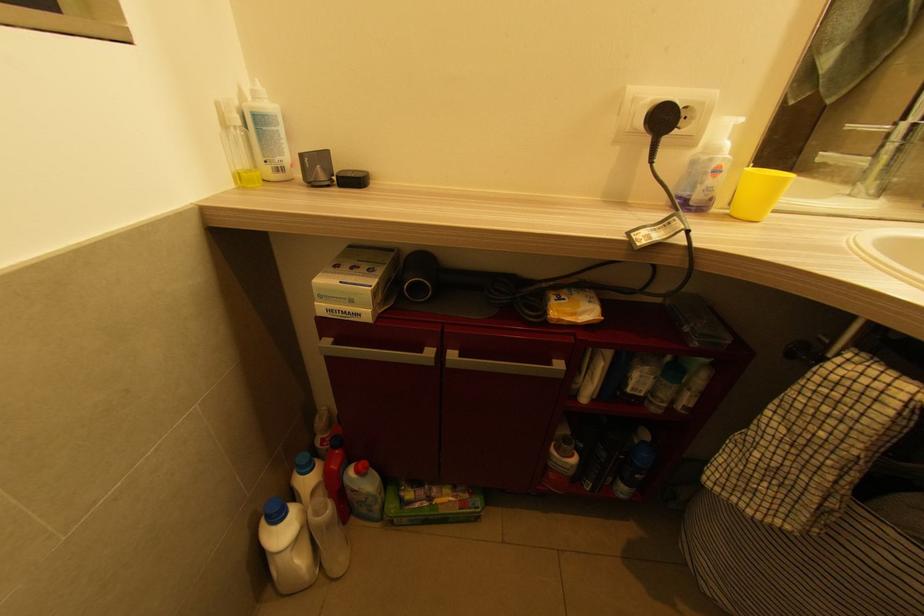
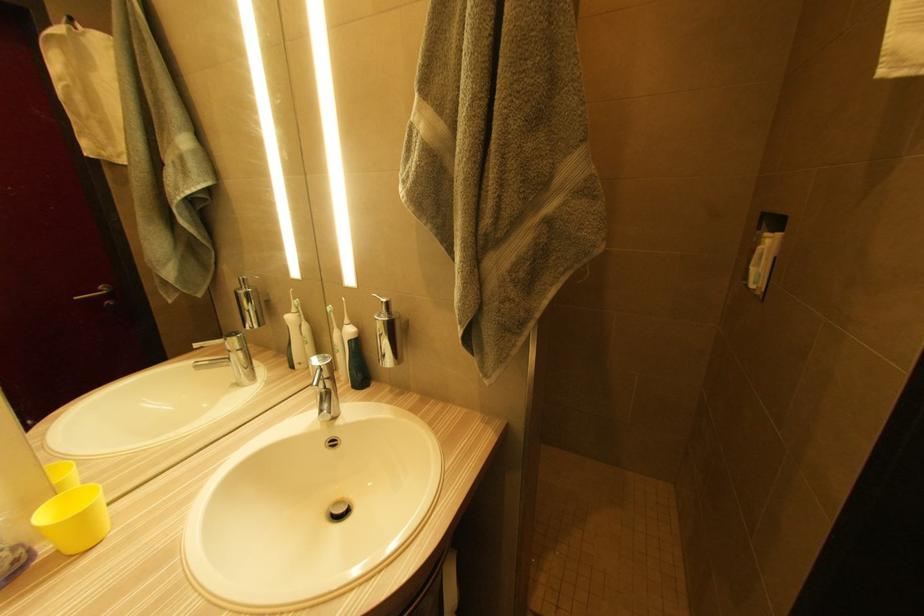
Question: The camera is either moving clockwise (left) or counter-clockwise (right) around the object. The first image is from the beginning of the video and the second image is from the end. Is the camera moving left or right when shooting the video?

Choices:
 (A) Left
 (B) Right

Answer: (A)